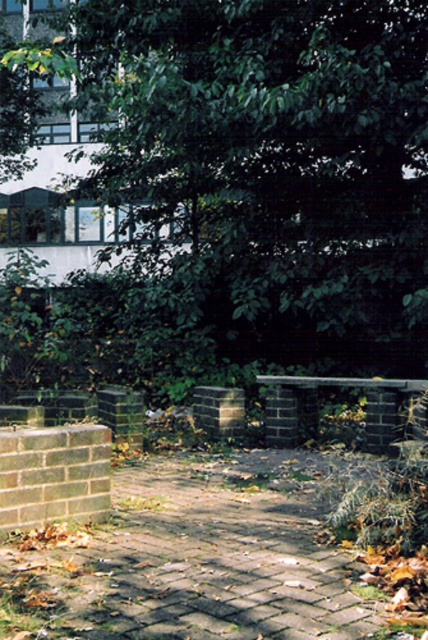
You are a gardener planning to trim the green leafy tree at upper center and maintain the brick paved path at center. Based on their sizes, which task might require more attention to detail due to the object being smaller?

The green leafy tree at upper center requires more attention to detail because its width is less than the brick paved path at center, making it smaller and potentially more delicate to work with.

You are standing at the point closer to the camera between the two points, point [190,52] and point [201,461]. Which point are you standing at?

You are standing at point [190,52] because it is further to the camera than point [201,461].

You are standing at the start of the paved pathway bordered by low brick walls. You notice a green leafy tree at upper center in the background. Based on its position, can you determine if the tree is closer to the left or right side of the pathway?

The green leafy tree at upper center is located at point coordinates that place it closer to the left side of the pathway since its x coordinate is 0.275, which is less than 0.5, indicating it is positioned to the left half of the scene.